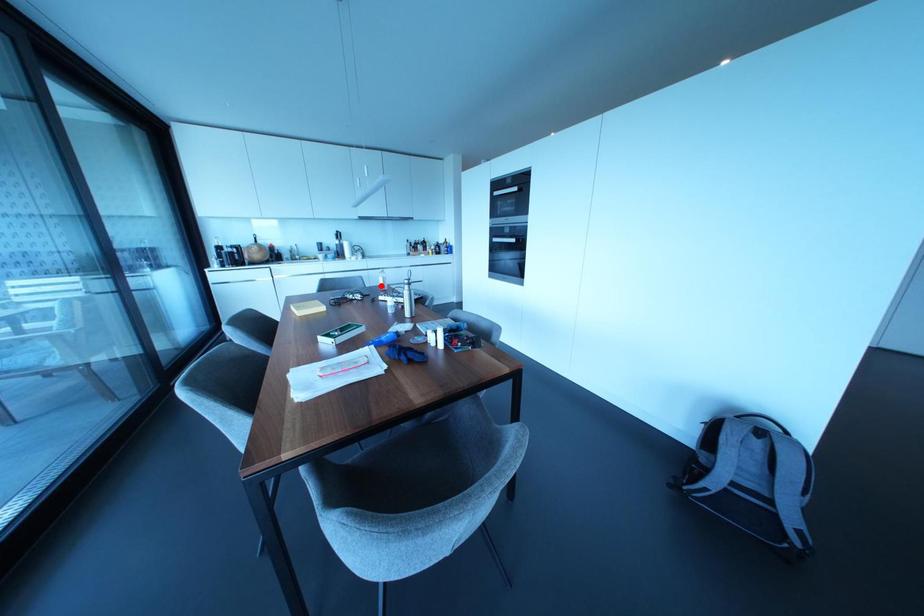
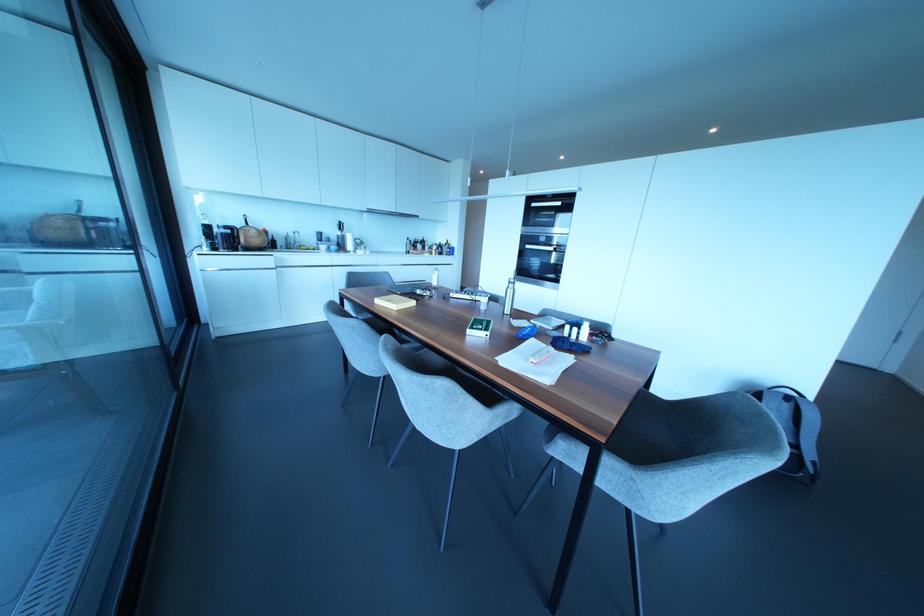
The point at the highlighted location is marked in the first image. Where is the corresponding point in the second image?

(434, 283)